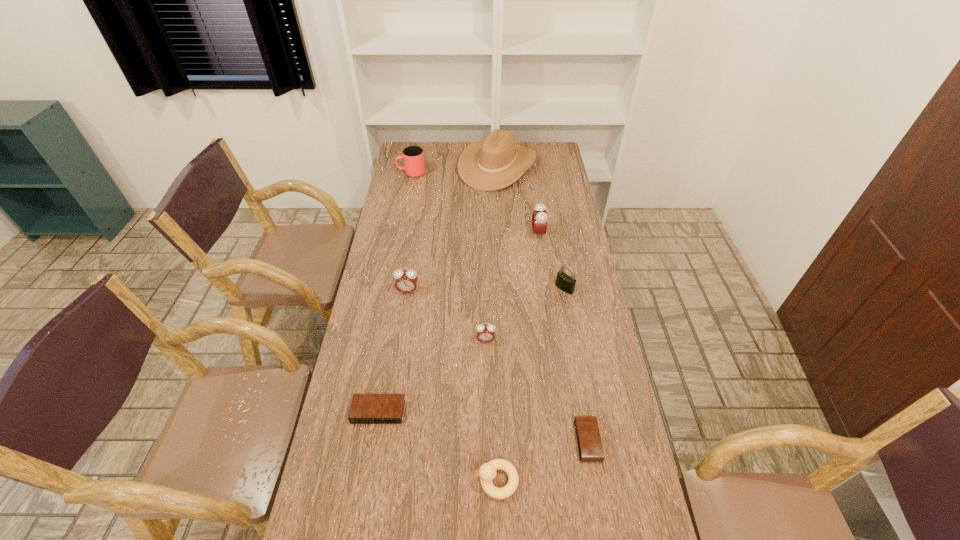
Identify which black alarm clock is the second closest to the cowboy hat. Please provide its 2D coordinates. Your answer should be formatted as a tuple, i.e. [(x, y)], where the tuple contains the x and y coordinates of a point satisfying the conditions above.

[(590, 448)]

Where is `vacant position in the image that satisfies the following two spatial constraints: 1. on the front side of the cowboy hat; 2. at the beak of the duckling`? vacant position in the image that satisfies the following two spatial constraints: 1. on the front side of the cowboy hat; 2. at the beak of the duckling is located at coordinates coord(513,481).

You are a GUI agent. You are given a task and a screenshot of the screen. Output one action in this format:
    pyautogui.click(x=<x>, y=<y>)
    Task: Click on the free location that satisfies the following two spatial constraints: 1. on the handle side of the cup; 2. on the left side of the cowboy hat
    This screenshot has height=540, width=960.
    Given the screenshot: What is the action you would take?
    pyautogui.click(x=413, y=166)

You are a GUI agent. You are given a task and a screenshot of the screen. Output one action in this format:
    pyautogui.click(x=<x>, y=<y>)
    Task: Click on the free space that satisfies the following two spatial constraints: 1. on the front side of the black padlock; 2. on the right side of the cowboy hat
    
    Given the screenshot: What is the action you would take?
    pyautogui.click(x=503, y=288)

Image resolution: width=960 pixels, height=540 pixels. I want to click on free point that satisfies the following two spatial constraints: 1. on the clock face of the rightmost pink alarm clock; 2. on the front face of the eighth tallest object, so click(x=563, y=412).